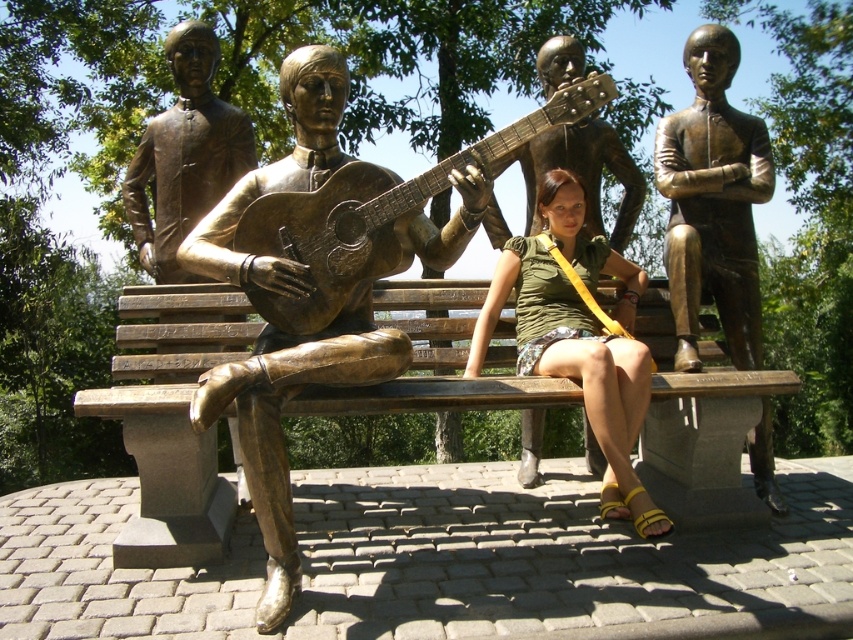
You are a sculptor who wants to create a miniature version of the scene. You need to ensure the proportions between the bronze bench at center and the bronze statue of man playing guitar at center are accurate. Which object should be made smaller in the miniature to maintain the correct scale?

The bronze bench at center should be made smaller in the miniature since it is already smaller than the bronze statue of man playing guitar at center in the original scene.

You are a visitor standing in front of the bronze sculpture. You want to take a photo of the bronze statue of man playing guitar at center without including the bronze bench at center in the frame. Is it possible to do so given their positions?

The bronze bench at center is closer to the viewer than the bronze statue of man playing guitar at center. Since the bench is in front of the statue, it would block the view of the statue, making it impossible to take a photo of the statue without including the bench in the frame.